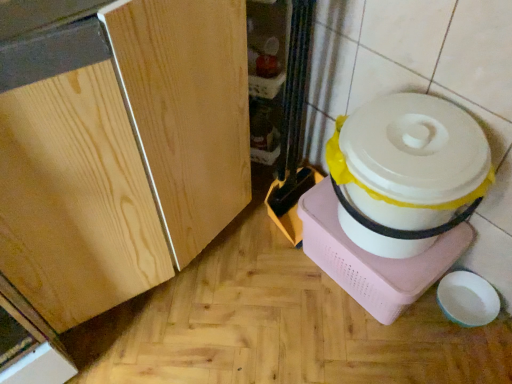
Question: Should I look upward or downward to see white plastic rice cooker at right?

Choices:
 (A) down
 (B) up

Answer: (B)

Question: Would you consider light wood cabinet at center to be distant from white plastic rice cooker at right?

Choices:
 (A) no
 (B) yes

Answer: (A)

Question: From the image's perspective, is light wood cabinet at center below white plastic rice cooker at right?

Choices:
 (A) yes
 (B) no

Answer: (B)

Question: Considering the relative sizes of light wood cabinet at center and white plastic rice cooker at right in the image provided, is light wood cabinet at center wider than white plastic rice cooker at right?

Choices:
 (A) yes
 (B) no

Answer: (A)

Question: Does light wood cabinet at center appear on the left side of white plastic rice cooker at right?

Choices:
 (A) yes
 (B) no

Answer: (A)

Question: Could you tell me if light wood cabinet at center is turned towards white plastic rice cooker at right?

Choices:
 (A) yes
 (B) no

Answer: (A)

Question: Is light wood cabinet at center positioned before white plastic rice cooker at right?

Choices:
 (A) yes
 (B) no

Answer: (A)

Question: From a real-world perspective, is white plastic rice cooker at right positioned under light wood cabinet at center based on gravity?

Choices:
 (A) yes
 (B) no

Answer: (A)

Question: Is white plastic rice cooker at right in front of light wood cabinet at center?

Choices:
 (A) yes
 (B) no

Answer: (B)

Question: Is white plastic rice cooker at right further to camera compared to light wood cabinet at center?

Choices:
 (A) yes
 (B) no

Answer: (A)

Question: Can you see white plastic rice cooker at right touching light wood cabinet at center?

Choices:
 (A) no
 (B) yes

Answer: (A)

Question: Can you confirm if white plastic rice cooker at right is shorter than light wood cabinet at center?

Choices:
 (A) no
 (B) yes

Answer: (B)

Question: From a real-world perspective, is white plastic rice cooker at right located higher than light wood cabinet at center?

Choices:
 (A) no
 (B) yes

Answer: (A)

Question: Choose the correct answer: Is white plastic rice cooker at right inside light wood cabinet at center or outside it?

Choices:
 (A) outside
 (B) inside

Answer: (A)